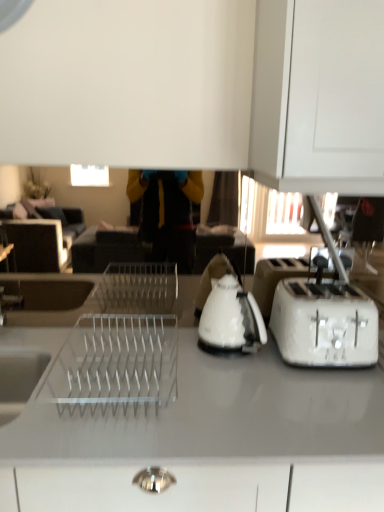
Question: In the image, is white glossy countertop at center on the left side or the right side of white glossy kettle at center?

Choices:
 (A) left
 (B) right

Answer: (A)

Question: Considering the positions of white glossy countertop at center and white glossy kettle at center in the image, is white glossy countertop at center bigger or smaller than white glossy kettle at center?

Choices:
 (A) big
 (B) small

Answer: (A)

Question: Estimate the real-world distances between objects in this image. Which object is farther from the white glossy kettle at center?

Choices:
 (A) white glossy countertop at center
 (B) white plastic toaster at right

Answer: (A)

Question: Based on their relative distances, which object is nearer to the white glossy kettle at center?

Choices:
 (A) white glossy countertop at center
 (B) white plastic toaster at right

Answer: (B)